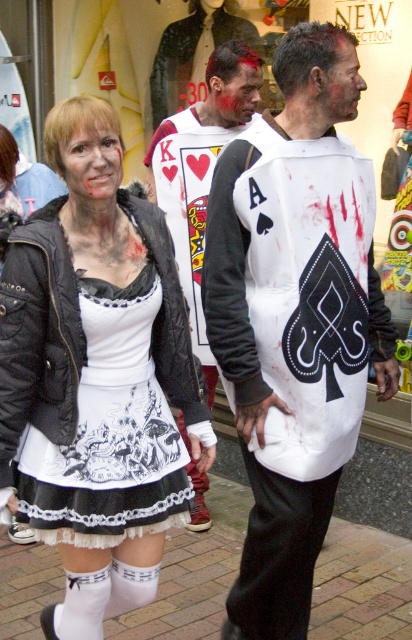
Is white matte dress at center taller than white printed fabric dress at center?

Yes.

Who is lower down, white matte dress at center or white printed fabric dress at center?

Positioned lower is white printed fabric dress at center.

Identify the location of white matte dress at center. (96, 376).

At what (x,y) coordinates should I click in order to perform the action: click on white matte dress at center. Please return your answer as a coordinate pair (x, y). Looking at the image, I should click on (96, 376).

Does white matte vest at center have a greater height compared to white jersey at center?

Correct, white matte vest at center is much taller as white jersey at center.

Can you confirm if white matte vest at center is thinner than white jersey at center?

Incorrect, white matte vest at center's width is not less than white jersey at center's.

Between point (250, 248) and point (164, 172), which one is positioned in front?

Point (250, 248) is in front.

Where is `white matte vest at center`? white matte vest at center is located at coordinates (294, 320).

Can you confirm if white matte vest at center is positioned to the left of white printed fabric dress at center?

Incorrect, white matte vest at center is not on the left side of white printed fabric dress at center.

Does point (273, 618) come in front of point (175, 458)?

No, it is behind (175, 458).

Where is `white matte vest at center`? white matte vest at center is located at coordinates (294, 320).